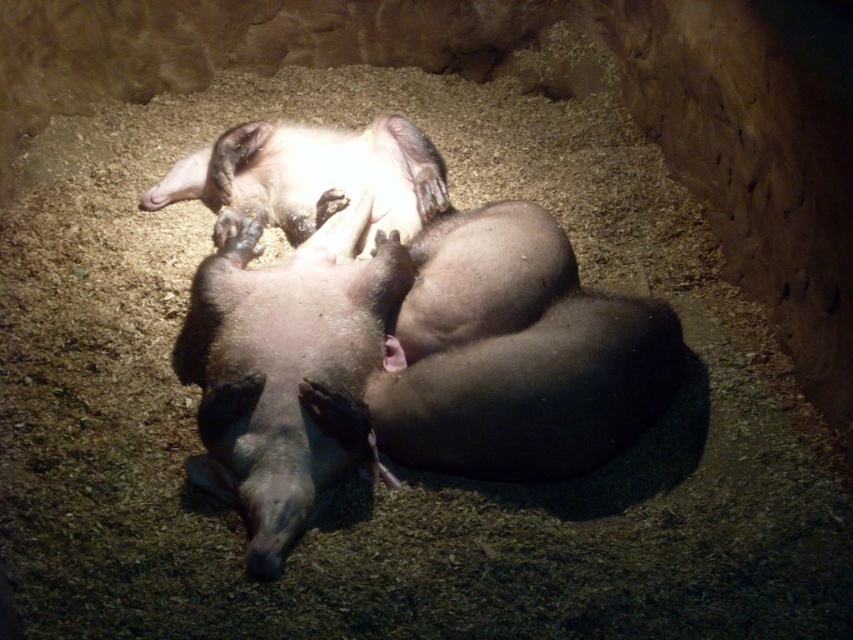
You are a farmer who wants to separate the pigs for feeding. The smooth pink piglet at center needs to be moved to a pen 2 meters away. Can you move it to the pen without moving the other pigs?

The smooth pink piglet at center is currently 1.90 meters away from the other pigs. Since the pen is 2 meters away, you can move the smooth pink piglet at center to the pen without disturbing the others as the distance is sufficient.